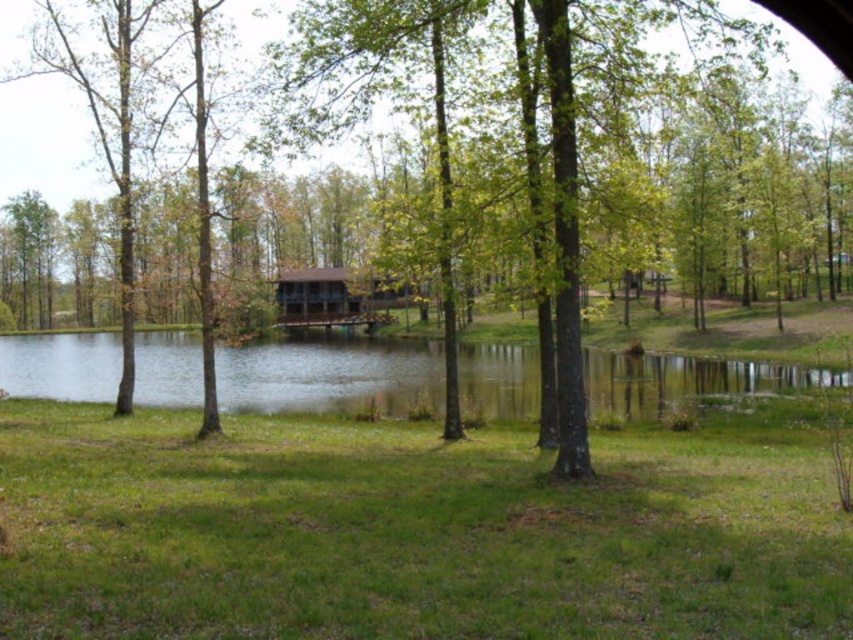
In the scene shown: You are standing on the grassy area near the pond and want to reach the brown wooden cabin at center. Since the clear water at center is in your path, can you walk directly to the cabin without stepping into the water?

The brown wooden cabin at center is behind clear water at center, so you cannot walk directly to the cabin without stepping into the water because the water is in front of the cabin.

You are standing at the edge of the pond and want to walk to the brown wooden cabin at center. Which direction should you walk to reach it from the clear water at center?

The clear water at center is to the left of the brown wooden cabin at center, so you should walk to the right to reach the cabin from the clear water at center.